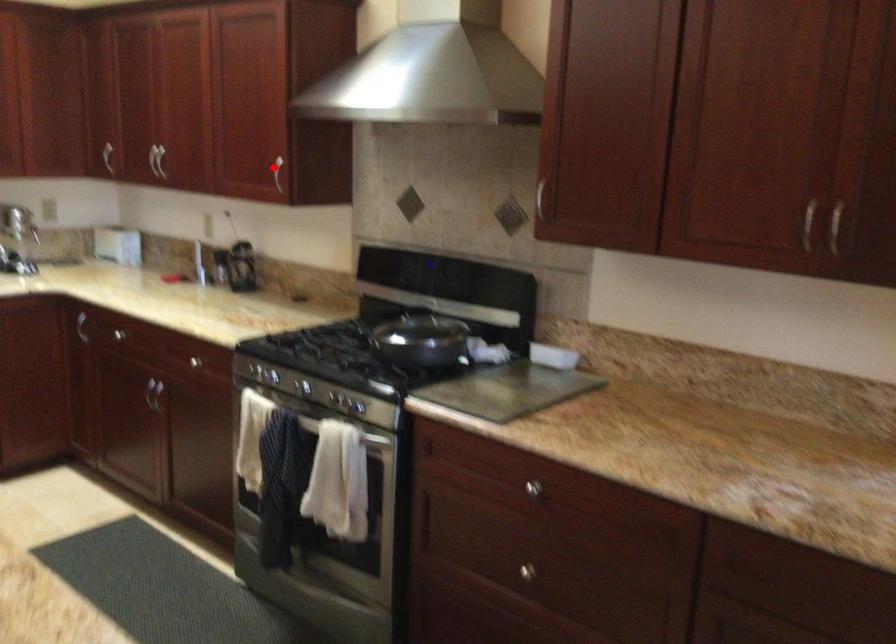
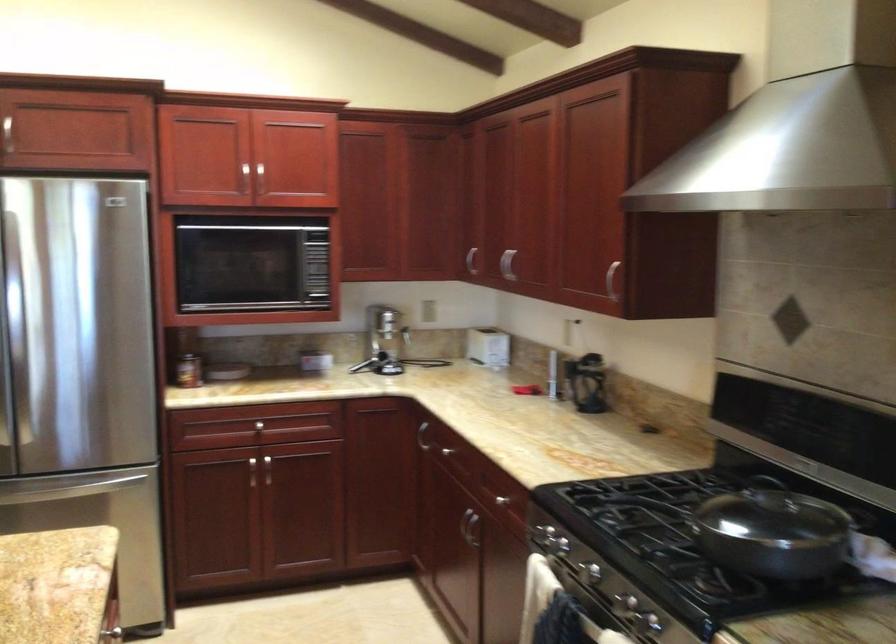
Question: I am providing you with two images of the same scene from different viewpoints. Image1 has a red point marked. In image2, the corresponding 3D location appears at what relative position? Reply with the corresponding letter.

Choices:
 (A) Closer
 (B) Farther

Answer: (A)